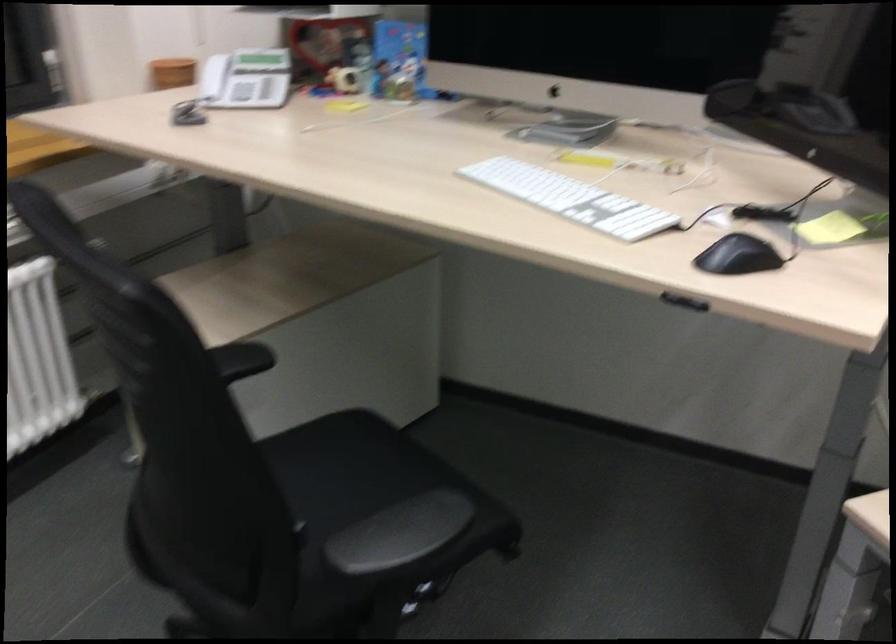
Find where to sit the chair sitting surface. Please return your answer as a coordinate pair (x, y).

(376, 483)